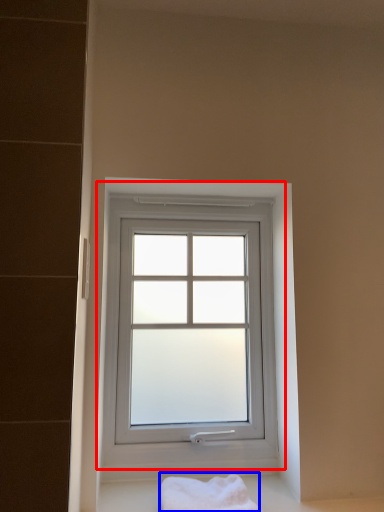
Question: Which point is further to the camera, window (highlighted by a red box) or bath towel (highlighted by a blue box)?

Choices:
 (A) window
 (B) bath towel

Answer: (A)